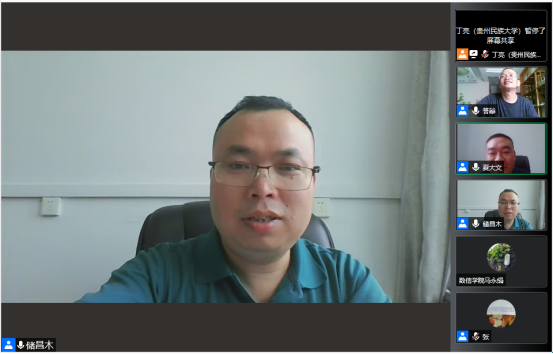
Find the location of a particular element. The width and height of the screenshot is (553, 354). chair is located at coordinates (525, 166).